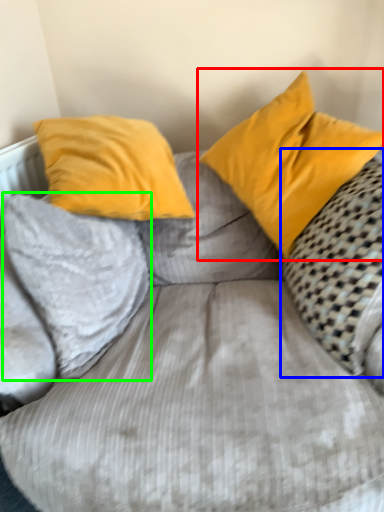
Question: Based on their relative distances, which object is farther from pillow (highlighted by a red box)? Choose from pillow (highlighted by a blue box) and pillow (highlighted by a green box).

Choices:
 (A) pillow
 (B) pillow

Answer: (B)